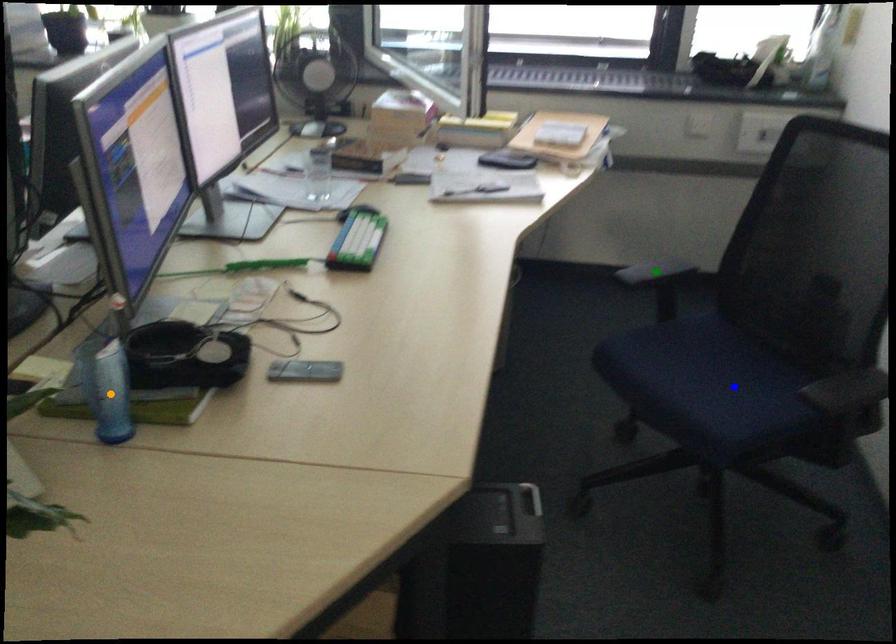
Order these from nearest to farthest:
A) green point
B) orange point
C) blue point

orange point
blue point
green point